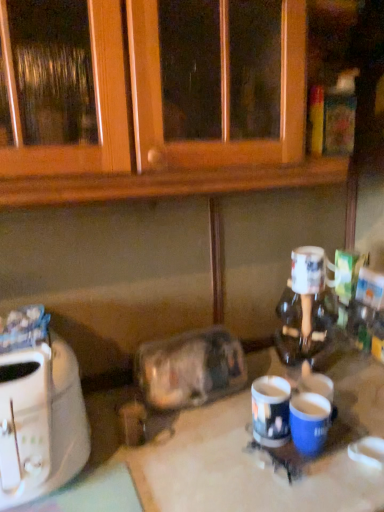
Where is `white plastic toaster at left`? white plastic toaster at left is located at coordinates (43, 419).

Describe the element at coordinates (43, 419) in the screenshot. This screenshot has width=384, height=512. I see `white plastic toaster at left` at that location.

Describe the element at coordinates (309, 422) in the screenshot. I see `blue matte mug at lower center, the 1th coffee cup from the bottom` at that location.

What do you see at coordinates (262, 455) in the screenshot? I see `white glossy table at center` at bounding box center [262, 455].

What is the approximate width of white glossy table at center?

white glossy table at center is 25.17 inches wide.

The height and width of the screenshot is (512, 384). In order to click on white plastic toaster at left in this screenshot , I will do `click(43, 419)`.

Between blue matte mug at lower center, which is the 3th coffee cup from top to bottom, and white plastic toaster at left, which one has larger width?

With larger width is white plastic toaster at left.

Is blue matte mug at lower center, the 1th coffee cup from the bottom, oriented away from white plastic toaster at left?

That's not correct — blue matte mug at lower center, the 1th coffee cup from the bottom, is not looking away from white plastic toaster at left.

Is blue matte mug at lower center, the 1th coffee cup from the bottom, in contact with white plastic toaster at left?

There is a gap between blue matte mug at lower center, the 1th coffee cup from the bottom, and white plastic toaster at left.

From the image's perspective, which coffee cup is the 2nd one below the white plastic toaster at left? Please provide its 2D coordinates.

[(309, 422)]

From the image's perspective, is transparent plastic container at center above or below white glossy mug at right, positioned as the third coffee cup in bottom-to-top order?

Clearly, from the image's perspective, transparent plastic container at center is below white glossy mug at right, positioned as the third coffee cup in bottom-to-top order.

Between transparent plastic container at center and white glossy mug at right, positioned as the third coffee cup in bottom-to-top order, which one has larger width?

Wider between the two is transparent plastic container at center.

Considering the positions of objects transparent plastic container at center and white glossy mug at right, which appears as the first coffee cup when viewed from the top, in the image provided, who is more to the right, transparent plastic container at center or white glossy mug at right, which appears as the first coffee cup when viewed from the top,?

white glossy mug at right, which appears as the first coffee cup when viewed from the top, is more to the right.

In terms of height, does transparent plastic container at center look taller or shorter compared to white glossy mug at right, positioned as the third coffee cup in bottom-to-top order?

Considering their sizes, transparent plastic container at center has more height than white glossy mug at right, positioned as the third coffee cup in bottom-to-top order.

Is blue matte mug at lower center, the 1th coffee cup from the bottom, closer to the viewer compared to blue glossy mug at center, the 2th coffee cup when ordered from top to bottom?

Yes, it is in front of blue glossy mug at center, the 2th coffee cup when ordered from top to bottom.

Is blue matte mug at lower center, the 1th coffee cup from the bottom, at the right side of blue glossy mug at center, positioned as the second coffee cup in bottom-to-top order?

Indeed, blue matte mug at lower center, the 1th coffee cup from the bottom, is positioned on the right side of blue glossy mug at center, positioned as the second coffee cup in bottom-to-top order.

Is blue matte mug at lower center, the 1th coffee cup from the bottom, completely or partially outside of blue glossy mug at center, the 2th coffee cup when ordered from top to bottom?

Yes.

From the image's perspective, who appears lower, blue matte mug at lower center, the 1th coffee cup from the bottom, or blue glossy mug at center, positioned as the second coffee cup in bottom-to-top order?

From the image's view, blue matte mug at lower center, the 1th coffee cup from the bottom, is below.

What are the coordinates of `the 1st coffee cup directly beneath the white plastic toaster at left (from a real-world perspective)` in the screenshot? It's located at (270, 410).

Which of these two, blue glossy mug at center, positioned as the second coffee cup in bottom-to-top order, or white plastic toaster at left, is thinner?

With smaller width is blue glossy mug at center, positioned as the second coffee cup in bottom-to-top order.

Does blue glossy mug at center, positioned as the second coffee cup in bottom-to-top order, turn towards white plastic toaster at left?

No, blue glossy mug at center, positioned as the second coffee cup in bottom-to-top order, is not oriented towards white plastic toaster at left.

Is blue glossy mug at center, the 2th coffee cup when ordered from top to bottom, positioned far away from white plastic toaster at left?

No, blue glossy mug at center, the 2th coffee cup when ordered from top to bottom, is in close proximity to white plastic toaster at left.

Looking at this image, is white glossy mug at right, which appears as the first coffee cup when viewed from the top, closer to the viewer compared to white glossy table at center?

No, white glossy mug at right, which appears as the first coffee cup when viewed from the top, is further to the viewer.

Is white glossy mug at right, positioned as the third coffee cup in bottom-to-top order, touching white glossy table at center?

white glossy mug at right, positioned as the third coffee cup in bottom-to-top order, and white glossy table at center are not in contact.

Which is more to the left, white glossy mug at right, positioned as the third coffee cup in bottom-to-top order, or white glossy table at center?

Positioned to the left is white glossy table at center.

Considering the relative sizes of white glossy mug at right, positioned as the third coffee cup in bottom-to-top order, and white glossy table at center in the image provided, is white glossy mug at right, positioned as the third coffee cup in bottom-to-top order, shorter than white glossy table at center?

Yes.

Is there a large distance between white glossy mug at right, positioned as the third coffee cup in bottom-to-top order, and blue matte mug at lower center, the 1th coffee cup from the bottom?

white glossy mug at right, positioned as the third coffee cup in bottom-to-top order, is near blue matte mug at lower center, the 1th coffee cup from the bottom, not far away.

Which of these two, white glossy mug at right, positioned as the third coffee cup in bottom-to-top order, or blue matte mug at lower center, the 1th coffee cup from the bottom, is wider?

white glossy mug at right, positioned as the third coffee cup in bottom-to-top order, is wider.

Which is behind, point (297, 276) or point (290, 421)?

The point (297, 276) is behind.

Is white glossy mug at right, positioned as the third coffee cup in bottom-to-top order, to the left or to the right of blue matte mug at lower center, which is the 3th coffee cup from top to bottom, in the image?

Based on their positions, white glossy mug at right, positioned as the third coffee cup in bottom-to-top order, is located to the right of blue matte mug at lower center, which is the 3th coffee cup from top to bottom.

Is transparent plastic container at center taller or shorter than blue matte mug at lower center, which is the 3th coffee cup from top to bottom?

In the image, transparent plastic container at center appears to be taller than blue matte mug at lower center, which is the 3th coffee cup from top to bottom.

Is transparent plastic container at center turned away from blue matte mug at lower center, which is the 3th coffee cup from top to bottom?

No.

Looking at this image, from the image's perspective, which is below, transparent plastic container at center or blue matte mug at lower center, which is the 3th coffee cup from top to bottom?

blue matte mug at lower center, which is the 3th coffee cup from top to bottom.

Locate an element on the screen. coffee cup that is the 2nd one when counting rightward from the white plastic toaster at left is located at coordinates point(309,422).

In the image, there is a white glossy mug at right, positioned as the third coffee cup in bottom-to-top order. At what (x,y) coordinates should I click in order to perform the action: click on appliance below it (from the image's perspective). Please return your answer as a coordinate pair (x, y). This screenshot has width=384, height=512. Looking at the image, I should click on (190, 368).

From the picture: Estimate the real-world distances between objects in this image. Which object is further from white glossy table at center, white plastic toaster at left or blue matte mug at lower center, which is the 3th coffee cup from top to bottom?

The object further to white glossy table at center is white plastic toaster at left.

Looking at the image, which one is located closer to white plastic toaster at left, blue glossy mug at center, the 2th coffee cup when ordered from top to bottom, or transparent plastic container at center?

transparent plastic container at center.

From the image, which object appears to be farther from white glossy table at center, blue matte mug at lower center, which is the 3th coffee cup from top to bottom, or transparent plastic container at center?

transparent plastic container at center is positioned further to the anchor white glossy table at center.

From the image, which object appears to be nearer to blue glossy mug at center, positioned as the second coffee cup in bottom-to-top order, white plastic toaster at left or blue matte mug at lower center, which is the 3th coffee cup from top to bottom?

blue matte mug at lower center, which is the 3th coffee cup from top to bottom, is closer to blue glossy mug at center, positioned as the second coffee cup in bottom-to-top order.

From the image, which object appears to be farther from white glossy mug at right, positioned as the third coffee cup in bottom-to-top order, blue glossy mug at center, positioned as the second coffee cup in bottom-to-top order, or transparent plastic container at center?

transparent plastic container at center lies further to white glossy mug at right, positioned as the third coffee cup in bottom-to-top order, than the other object.

Based on the photo, estimate the real-world distances between objects in this image. Which object is closer to white plastic toaster at left, blue matte mug at lower center, the 1th coffee cup from the bottom, or blue glossy mug at center, positioned as the second coffee cup in bottom-to-top order?

blue glossy mug at center, positioned as the second coffee cup in bottom-to-top order, is positioned closer to the anchor white plastic toaster at left.

From the image, which object appears to be farther from white plastic toaster at left, white glossy mug at right, which appears as the first coffee cup when viewed from the top, or blue matte mug at lower center, the 1th coffee cup from the bottom?

Based on the image, white glossy mug at right, which appears as the first coffee cup when viewed from the top, appears to be further to white plastic toaster at left.

Looking at the image, which one is located further to white glossy mug at right, positioned as the third coffee cup in bottom-to-top order, blue matte mug at lower center, the 1th coffee cup from the bottom, or transparent plastic container at center?

The object further to white glossy mug at right, positioned as the third coffee cup in bottom-to-top order, is blue matte mug at lower center, the 1th coffee cup from the bottom.

The height and width of the screenshot is (512, 384). What are the coordinates of `coffee cup between white glossy mug at right, which appears as the first coffee cup when viewed from the top, and blue matte mug at lower center, the 1th coffee cup from the bottom, in the up-down direction` in the screenshot? It's located at (270, 410).

Image resolution: width=384 pixels, height=512 pixels. I want to click on toaster that lies between transparent plastic container at center and white glossy table at center from top to bottom, so click(x=43, y=419).

Locate an element on the screen. The height and width of the screenshot is (512, 384). table situated between white plastic toaster at left and blue glossy mug at center, positioned as the second coffee cup in bottom-to-top order, from left to right is located at coordinates (262, 455).

Where is `table between white plastic toaster at left and blue matte mug at lower center, which is the 3th coffee cup from top to bottom`? table between white plastic toaster at left and blue matte mug at lower center, which is the 3th coffee cup from top to bottom is located at coordinates (262, 455).